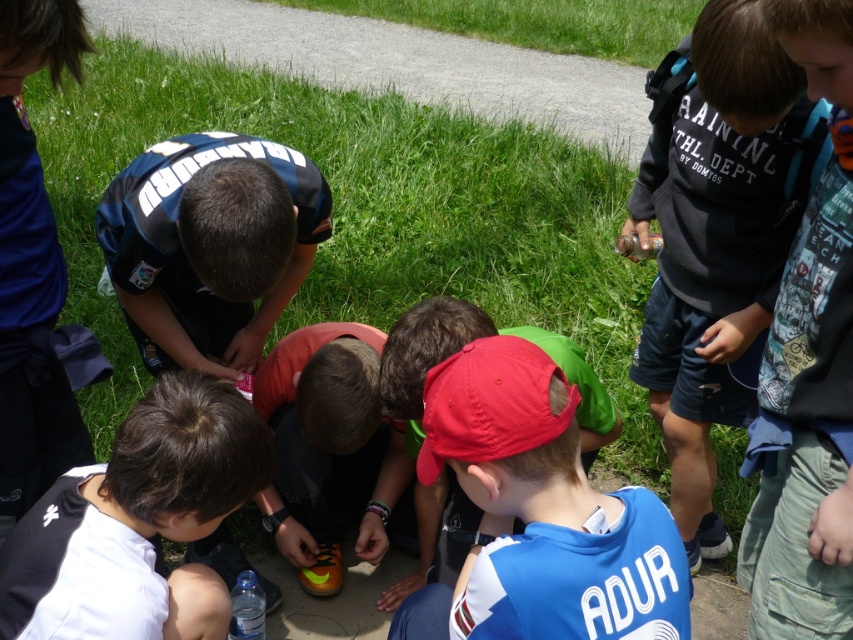
You are a soccer coach observing the children playing on the green grass at center and noticing the orange matte soccer shoe at center. Which object takes up more space in the image?

The green grass at center takes up more space in the image because it is bigger than the orange matte soccer shoe at center.

You are a photographer trying to capture a group shot of the children. You want to ensure that both the red matte cap at center and the black matte shirt at lower left are fully visible in the frame. Based on their sizes, which object should you focus on to ensure both are in the frame?

The red matte cap at center is wider than the black matte shirt at lower left, so focusing on the red matte cap at center would ensure both are in the frame as it requires a wider angle to capture its size, accommodating the smaller black matte shirt at lower left.

You are a photographer trying to capture a group shot of the children. You notice the blue jersey at center and the orange matte soccer shoe at center. Which object should you focus on to ensure it fits entirely within your camera frame if your frame can only accommodate the narrower of the two?

The orange matte soccer shoe at center should be focused on because its width is narrower than the blue jersey at center, so it will fit within the camera frame.